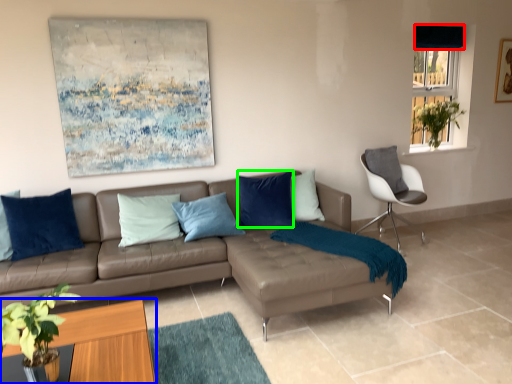
Question: Estimate the real-world distances between objects in this image. Which object is closer to curtain (highlighted by a red box), coffee table (highlighted by a blue box) or pillow (highlighted by a green box)?

Choices:
 (A) coffee table
 (B) pillow

Answer: (B)